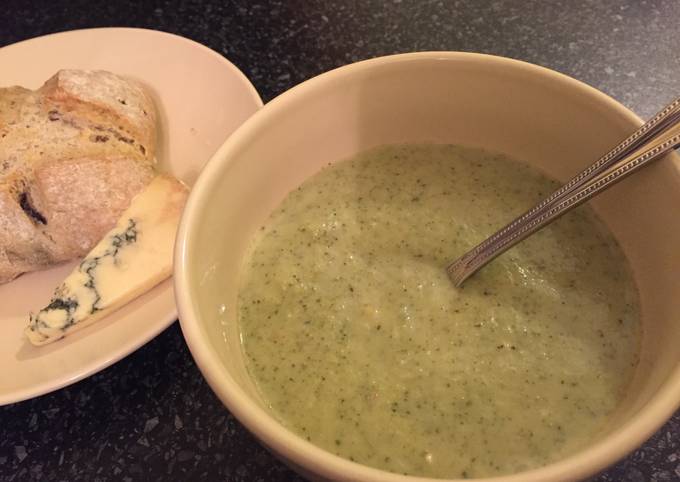
The width and height of the screenshot is (680, 482). Identify the location of white ceramic bowl. (226, 176).